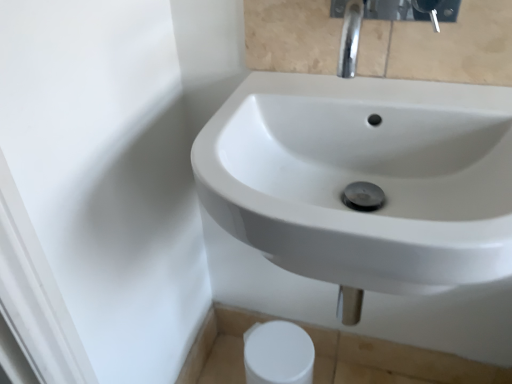
Question: Are white matte toilet paper at lower center and white glossy sink at center beside each other?

Choices:
 (A) no
 (B) yes

Answer: (A)

Question: From a real-world perspective, is white matte toilet paper at lower center positioned over white glossy sink at center based on gravity?

Choices:
 (A) yes
 (B) no

Answer: (B)

Question: Is white matte toilet paper at lower center oriented away from white glossy sink at center?

Choices:
 (A) yes
 (B) no

Answer: (B)

Question: From the image's perspective, is white matte toilet paper at lower center on top of white glossy sink at center?

Choices:
 (A) no
 (B) yes

Answer: (A)

Question: Would you consider white matte toilet paper at lower center to be distant from white glossy sink at center?

Choices:
 (A) yes
 (B) no

Answer: (B)

Question: Is white matte toilet paper at lower center at the left side of white glossy sink at center?

Choices:
 (A) no
 (B) yes

Answer: (B)

Question: Could you tell me if chrome metallic faucet at upper center is turned towards white glossy sink at center?

Choices:
 (A) no
 (B) yes

Answer: (A)

Question: Can you confirm if chrome metallic faucet at upper center is bigger than white glossy sink at center?

Choices:
 (A) no
 (B) yes

Answer: (A)

Question: From a real-world perspective, is chrome metallic faucet at upper center on white glossy sink at center?

Choices:
 (A) yes
 (B) no

Answer: (A)

Question: Is chrome metallic faucet at upper center at the left side of white glossy sink at center?

Choices:
 (A) no
 (B) yes

Answer: (A)

Question: Is chrome metallic faucet at upper center wider than white glossy sink at center?

Choices:
 (A) no
 (B) yes

Answer: (A)

Question: Is the position of chrome metallic faucet at upper center more distant than that of white glossy sink at center?

Choices:
 (A) no
 (B) yes

Answer: (B)

Question: Is white glossy sink at center with white matte toilet paper at lower center?

Choices:
 (A) yes
 (B) no

Answer: (B)